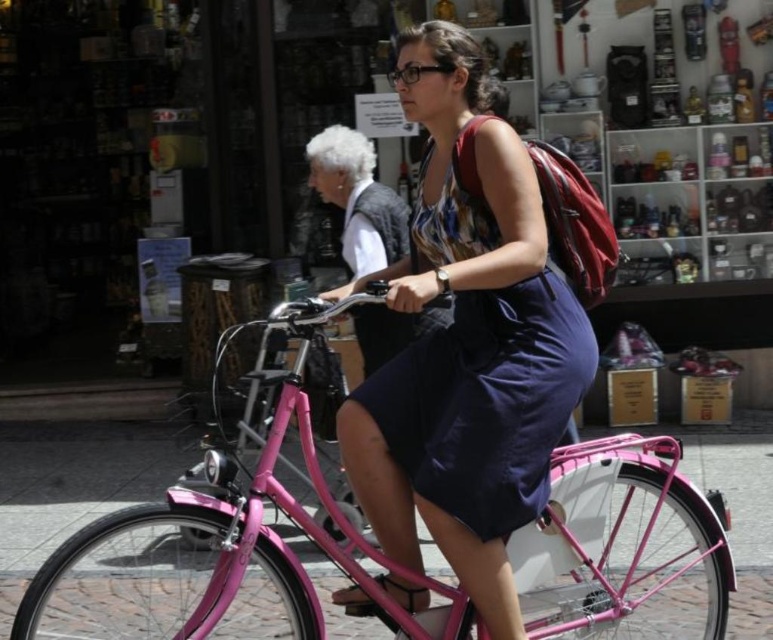
You are a pedestrian standing on the cobblestone street and want to cross to the other side. There is a pink metallic bicycle at center and a navy blue fabric dress at center in your way. Which object should you move around to avoid collision?

You should move around the pink metallic bicycle at center because it is to the right of the navy blue fabric dress at center, so moving around the bicycle would allow you to pass safely to the left side.